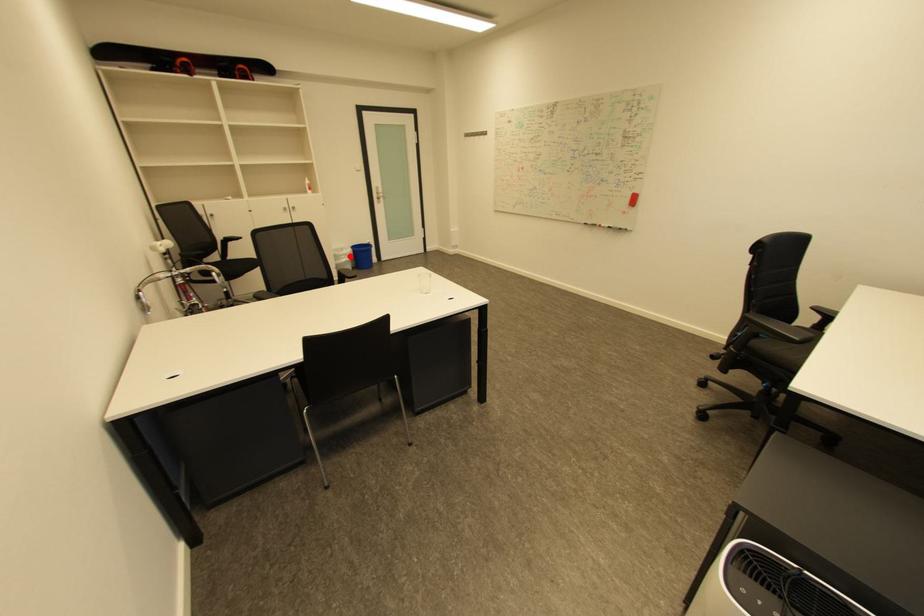
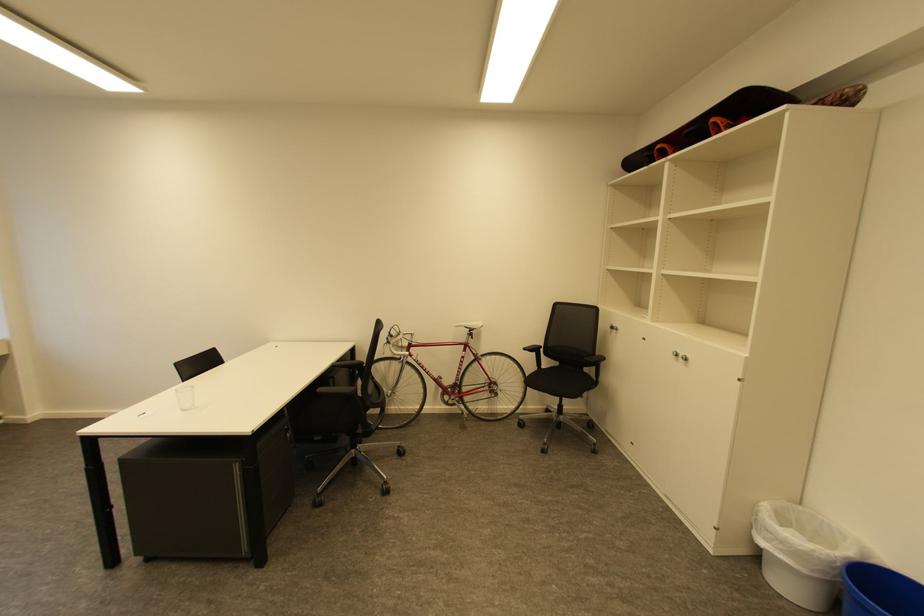
Question: I am providing you with two images of the same scene from different viewpoints. In image1, a red point is highlighted. Considering the same 3D point in image2, which of the following is correct?

Choices:
 (A) It is closer
 (B) It is farther

Answer: (B)